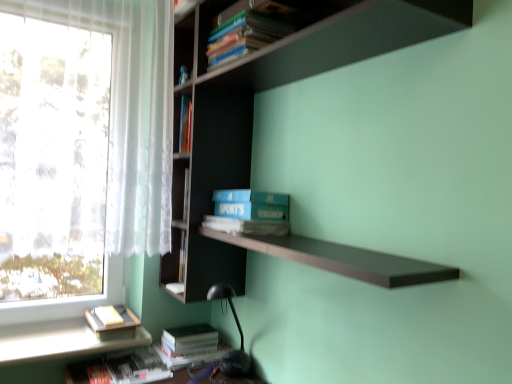
Question: Is blue matte sports book at center positioned behind hardcover book at lower left, which appears as the 1th book when ordered from the bottom?

Choices:
 (A) no
 (B) yes

Answer: (A)

Question: Is blue matte sports book at center not inside hardcover book at lower left, which is the 5th book from top to bottom?

Choices:
 (A) no
 (B) yes

Answer: (B)

Question: From the image's perspective, is blue matte sports book at center above hardcover book at lower left, which appears as the 1th book when ordered from the bottom?

Choices:
 (A) yes
 (B) no

Answer: (A)

Question: Considering the relative positions of blue matte sports book at center and hardcover book at lower left, which appears as the 1th book when ordered from the bottom, in the image provided, is blue matte sports book at center in front of hardcover book at lower left, which appears as the 1th book when ordered from the bottom,?

Choices:
 (A) no
 (B) yes

Answer: (B)

Question: Can you confirm if blue matte sports book at center is taller than hardcover book at lower left, which appears as the 1th book when ordered from the bottom?

Choices:
 (A) no
 (B) yes

Answer: (B)

Question: Considering the positions of dark wood bookcase at upper center and hardcover book at lower left, which is the 5th book from top to bottom, in the image, is dark wood bookcase at upper center wider or thinner than hardcover book at lower left, which is the 5th book from top to bottom,?

Choices:
 (A) wide
 (B) thin

Answer: (A)

Question: Is dark wood bookcase at upper center in front of or behind hardcover book at lower left, which appears as the 1th book when ordered from the bottom, in the image?

Choices:
 (A) front
 (B) behind

Answer: (A)

Question: From a real-world perspective, is dark wood bookcase at upper center positioned above or below hardcover book at lower left, which appears as the 1th book when ordered from the bottom?

Choices:
 (A) below
 (B) above

Answer: (B)

Question: Based on their sizes in the image, would you say dark wood bookcase at upper center is bigger or smaller than hardcover book at lower left, which appears as the 1th book when ordered from the bottom?

Choices:
 (A) big
 (B) small

Answer: (A)

Question: Would you say hardcover book at lower left, the third book in the top-to-bottom sequence, is inside or outside blue matte sports book at center?

Choices:
 (A) outside
 (B) inside

Answer: (A)

Question: Looking at the image, does hardcover book at lower left, the 3th book from the bottom, seem bigger or smaller compared to blue matte sports book at center?

Choices:
 (A) big
 (B) small

Answer: (B)

Question: Considering the relative positions of hardcover book at lower left, the 3th book from the bottom, and blue matte sports book at center in the image provided, is hardcover book at lower left, the 3th book from the bottom, to the left or to the right of blue matte sports book at center?

Choices:
 (A) left
 (B) right

Answer: (A)

Question: In terms of width, does hardcover book at lower left, the third book in the top-to-bottom sequence, look wider or thinner when compared to blue matte sports book at center?

Choices:
 (A) wide
 (B) thin

Answer: (A)

Question: From a real-world perspective, is hardcover book at lower left, which is the 5th book from top to bottom, physically located above or below hardcover books at upper center, marked as the first book in a top-to-bottom arrangement?

Choices:
 (A) above
 (B) below

Answer: (B)

Question: Based on their positions, is hardcover book at lower left, which appears as the 1th book when ordered from the bottom, located to the left or right of hardcover books at upper center, positioned as the fifth book in bottom-to-top order?

Choices:
 (A) right
 (B) left

Answer: (B)